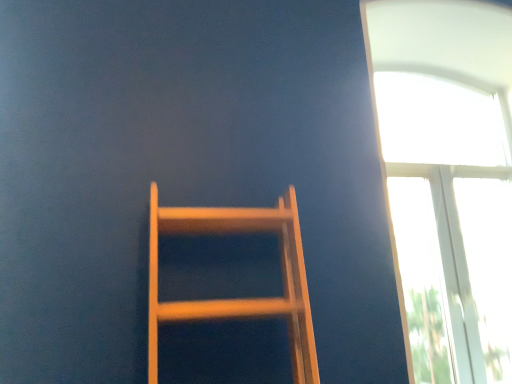
Question: From a real-world perspective, is wooden ladder at center positioned over transparent glass window at upper right based on gravity?

Choices:
 (A) no
 (B) yes

Answer: (A)

Question: Is wooden ladder at center taller than transparent glass window at upper right?

Choices:
 (A) no
 (B) yes

Answer: (A)

Question: Does wooden ladder at center have a lesser height compared to transparent glass window at upper right?

Choices:
 (A) no
 (B) yes

Answer: (B)

Question: From the image's perspective, is wooden ladder at center on transparent glass window at upper right?

Choices:
 (A) no
 (B) yes

Answer: (A)

Question: Is wooden ladder at center to the right of transparent glass window at upper right from the viewer's perspective?

Choices:
 (A) no
 (B) yes

Answer: (A)

Question: Would you say transparent glass window at upper right is part of wooden ladder at center's contents?

Choices:
 (A) yes
 (B) no

Answer: (B)

Question: Does transparent glass window at upper right have a greater height compared to wooden ladder at center?

Choices:
 (A) yes
 (B) no

Answer: (A)

Question: Is transparent glass window at upper right further to camera compared to wooden ladder at center?

Choices:
 (A) yes
 (B) no

Answer: (A)

Question: Considering the relative sizes of transparent glass window at upper right and wooden ladder at center in the image provided, is transparent glass window at upper right shorter than wooden ladder at center?

Choices:
 (A) yes
 (B) no

Answer: (B)

Question: From the image's perspective, is transparent glass window at upper right on top of wooden ladder at center?

Choices:
 (A) yes
 (B) no

Answer: (A)

Question: Could you tell me if transparent glass window at upper right is turned towards wooden ladder at center?

Choices:
 (A) yes
 (B) no

Answer: (B)

Question: Is transparent glass window at upper right positioned beyond the bounds of wooden ladder at center?

Choices:
 (A) no
 (B) yes

Answer: (B)

Question: Is wooden ladder at center wider or thinner than transparent glass window at upper right?

Choices:
 (A) thin
 (B) wide

Answer: (B)